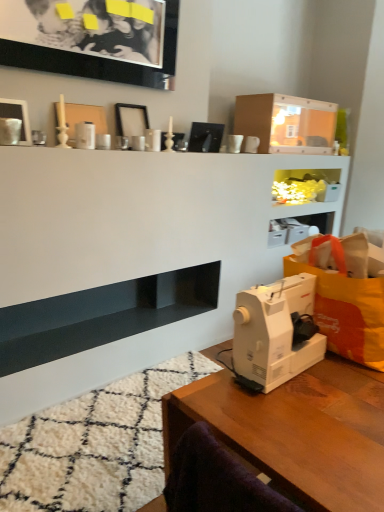
Question: Is white glossy picture frame at upper left, the 1th picture frame in the bottom-to-top sequence, wider or thinner than wooden table at lower right?

Choices:
 (A) wide
 (B) thin

Answer: (B)

Question: Is point (3, 117) positioned closer to the camera than point (175, 394)?

Choices:
 (A) farther
 (B) closer

Answer: (A)

Question: Considering the real-world distances, which object is closest to the black glossy picture frame at upper left, the first picture frame viewed from the top?

Choices:
 (A) orange fabric grocery bag at right
 (B) matte cardboard box at upper center
 (C) translucent plastic cabinet at upper center
 (D) wooden table at lower right
 (E) white glossy picture frame at upper left, the 1th picture frame in the bottom-to-top sequence

Answer: (E)

Question: Which object is positioned closest to the matte cardboard box at upper center?

Choices:
 (A) white plastic sewing machine at lower right
 (B) orange fabric grocery bag at right
 (C) black glossy picture frame at upper left, the first picture frame viewed from the top
 (D) translucent plastic cabinet at upper center
 (E) white matte picture frame at upper center, which ranks as the second picture frame in bottom-to-top order

Answer: (D)